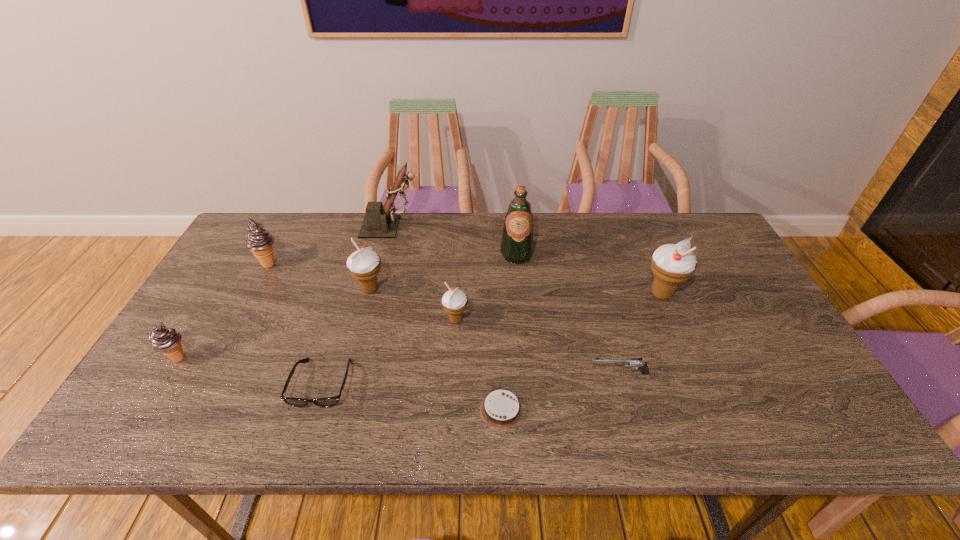
Find the location of a particular element. The height and width of the screenshot is (540, 960). the second white icecream from left to right is located at coordinates (454, 301).

Image resolution: width=960 pixels, height=540 pixels. Find the location of `the nearer chocolate icecream`. the nearer chocolate icecream is located at coordinates (166, 340).

You are a GUI agent. You are given a task and a screenshot of the screen. Output one action in this format:
    pyautogui.click(x=<x>, y=<y>)
    Task: Click on the leftmost icecream
    The image size is (960, 540).
    Given the screenshot: What is the action you would take?
    pyautogui.click(x=166, y=340)

You are a GUI agent. You are given a task and a screenshot of the screen. Output one action in this format:
    pyautogui.click(x=<x>, y=<y>)
    Task: Click on the ninth object from left to right
    The height and width of the screenshot is (540, 960).
    Given the screenshot: What is the action you would take?
    pyautogui.click(x=628, y=362)

Image resolution: width=960 pixels, height=540 pixels. I want to click on pistol, so click(x=628, y=362).

Identify the location of spectacles. (327, 401).

This screenshot has width=960, height=540. Identify the location of the shortest object. (501, 409).

I want to click on vacant space located 0.230m on the front-facing side of the brown figurine, so click(489, 227).

The height and width of the screenshot is (540, 960). Identify the location of vacant area situated on the front-facing side of the green olive oil. (520, 296).

Identify the location of free spot located on the front of the eighth shortest object. (699, 383).